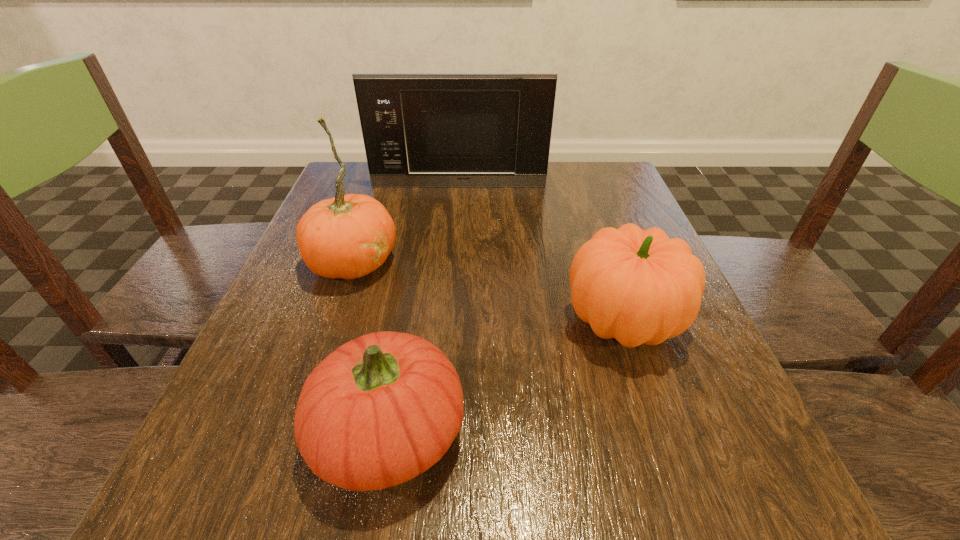
Where is `empty space that is in between the farthest object and the tallest pumpkin`? empty space that is in between the farthest object and the tallest pumpkin is located at coordinates (406, 224).

What are the coordinates of `empty location between the tallest pumpkin and the rightmost pumpkin` in the screenshot? It's located at (488, 291).

Find the location of a particular element. vacant area that lies between the nearest object and the farthest object is located at coordinates (423, 310).

You are a GUI agent. You are given a task and a screenshot of the screen. Output one action in this format:
    pyautogui.click(x=<x>, y=<y>)
    Task: Click on the blank region between the farthest object and the rightmost pumpkin
    
    Given the screenshot: What is the action you would take?
    pyautogui.click(x=540, y=254)

Identify the location of vacant area between the tallest pumpkin and the farthest object. The height and width of the screenshot is (540, 960). (406, 224).

You are a GUI agent. You are given a task and a screenshot of the screen. Output one action in this format:
    pyautogui.click(x=<x>, y=<y>)
    Task: Click on the free area in between the farthest object and the rightmost pumpkin
    
    Given the screenshot: What is the action you would take?
    pyautogui.click(x=540, y=254)

At what (x,y) coordinates should I click in order to perform the action: click on free space between the nearest pumpkin and the rightmost pumpkin. Please return your answer as a coordinate pair (x, y). The image size is (960, 540). Looking at the image, I should click on (506, 377).

Identify which object is the closest to the tallest pumpkin. Please provide its 2D coordinates. Your answer should be formatted as a tuple, i.e. [(x, y)], where the tuple contains the x and y coordinates of a point satisfying the conditions above.

[(381, 409)]

Locate an element on the screen. This screenshot has width=960, height=540. the third closest object to the microwave oven is located at coordinates (x=381, y=409).

The width and height of the screenshot is (960, 540). In order to click on the second closest pumpkin to the tallest pumpkin in this screenshot , I will do `click(636, 286)`.